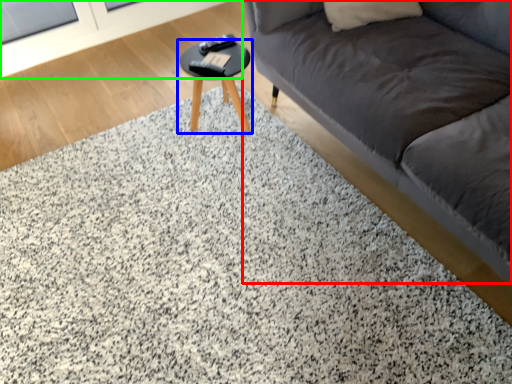
Question: Estimate the real-world distances between objects in this image. Which object is farther from studio couch (highlighted by a red box), table (highlighted by a blue box) or screen door (highlighted by a green box)?

Choices:
 (A) table
 (B) screen door

Answer: (B)